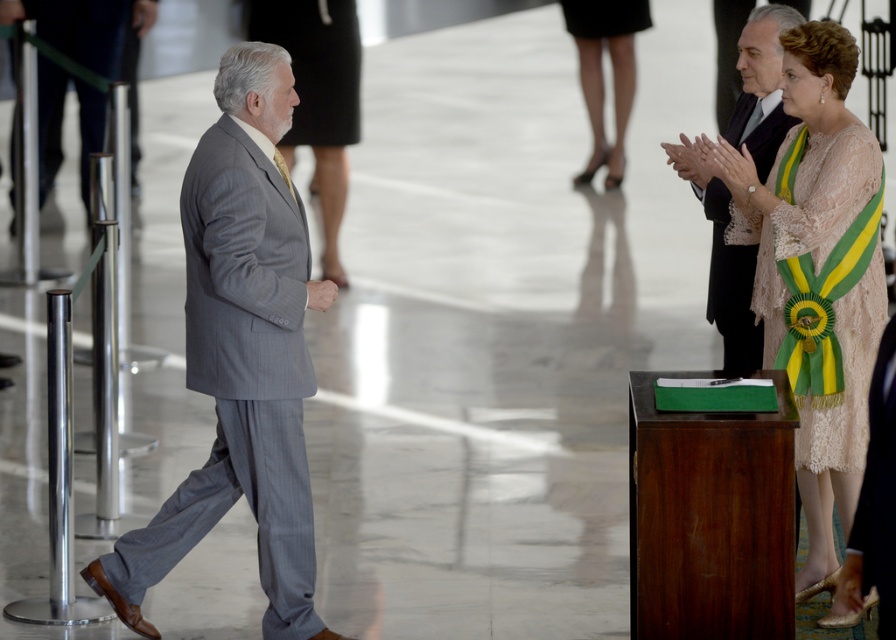
You are an event planner arranging seating for the attendees. You need to place the black satin suit at right and the matte black dress at center in a row of chairs. Considering their heights, which one should be placed in the front row to ensure visibility?

The black satin suit at right should be placed in the front row because it is shorter than the matte black dress at center, allowing the taller attendee to have a better view from behind.

You are attending the formal event and want to greet the person in the lace dress at right. Based on their position in the scene, where should you walk to find them?

The lace dress at right is located at point (816, 273), so you should walk towards the right side of the scene near the bottom to find them.